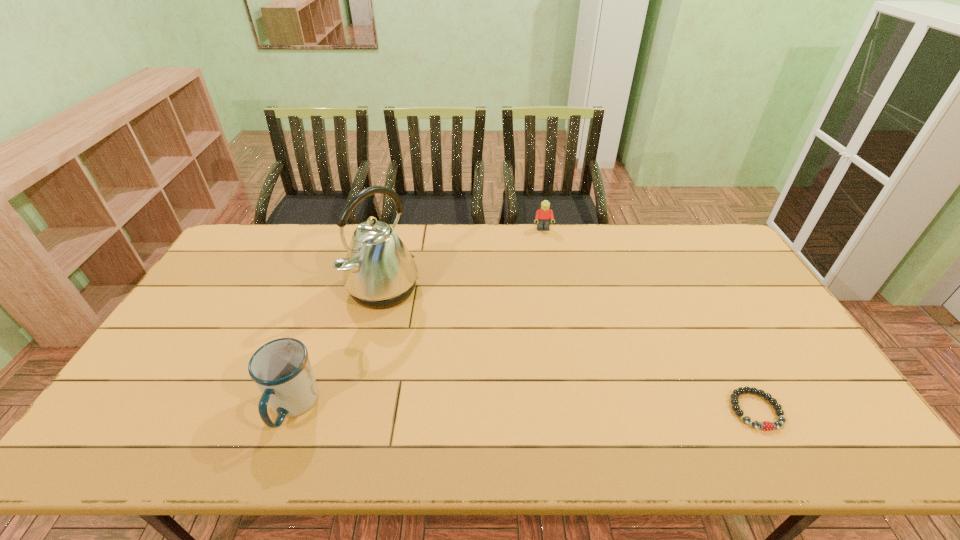
Find the location of `vacant region located 0.400m on the face of the Lego`. vacant region located 0.400m on the face of the Lego is located at coordinates (560, 309).

Where is `vacant space located 0.340m from the spout of the third nearest object`? Image resolution: width=960 pixels, height=540 pixels. vacant space located 0.340m from the spout of the third nearest object is located at coordinates (497, 360).

Locate an element on the screen. free space located 0.090m from the spout of the third nearest object is located at coordinates point(430,319).

The image size is (960, 540). I want to click on vacant space located from the spout of the third nearest object, so click(438, 323).

This screenshot has height=540, width=960. Find the location of `object that is at the far edge`. object that is at the far edge is located at coordinates (543, 216).

This screenshot has height=540, width=960. In order to click on mug that is at the near edge in this screenshot , I will do point(281,368).

The width and height of the screenshot is (960, 540). I want to click on bracelet that is at the near edge, so click(x=765, y=425).

Identify the location of object located in the right edge section of the desktop. (765, 425).

Image resolution: width=960 pixels, height=540 pixels. I want to click on object situated at the near right corner, so click(x=765, y=425).

In the image, there is a desktop. Identify the location of vacant space at the far edge. (599, 224).